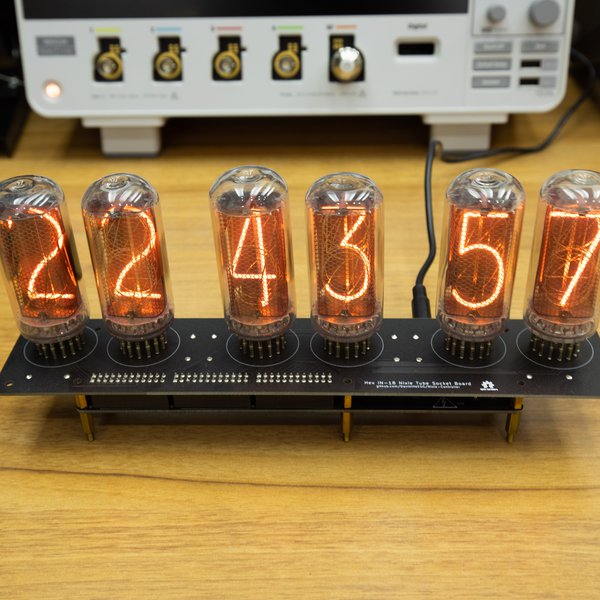
At what (x,y) coordinates should I click in order to perform the action: click on wood table. Please return your answer as a coordinate pair (x, y). This screenshot has height=600, width=600. Looking at the image, I should click on (514, 460), (409, 537).